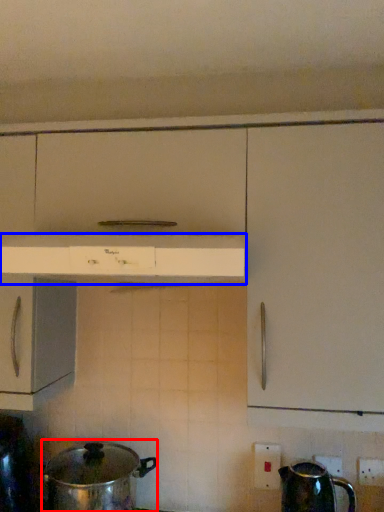
Question: Which object appears farthest to the camera in this image, crock pot (highlighted by a red box) or home appliance (highlighted by a blue box)?

Choices:
 (A) crock pot
 (B) home appliance

Answer: (A)